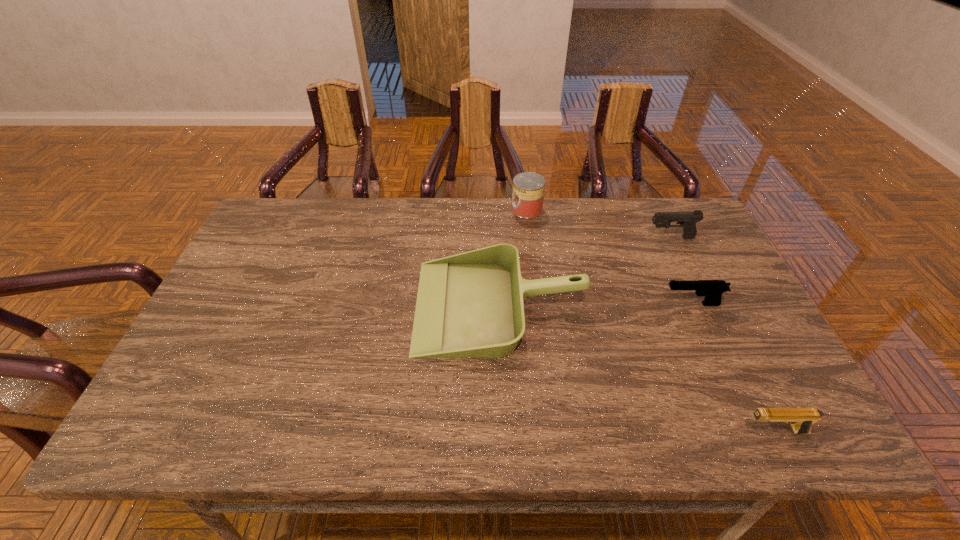
I want to click on free space between the nearest pistol and the second farthest pistol, so click(x=732, y=368).

Locate an element on the screen. The image size is (960, 540). vacant area that lies between the farthest object and the nearest object is located at coordinates pos(650,320).

Locate an element on the screen. The image size is (960, 540). vacant point located between the farthest object and the nearest object is located at coordinates (650, 320).

You are a GUI agent. You are given a task and a screenshot of the screen. Output one action in this format:
    pyautogui.click(x=<x>, y=<y>)
    Task: Click on the free point between the farthest pistol and the farthest object
    The width and height of the screenshot is (960, 540).
    Given the screenshot: What is the action you would take?
    pyautogui.click(x=599, y=224)

At what (x,y) coordinates should I click in order to perform the action: click on free space between the nearest object and the dustpan. Please return your answer as a coordinate pair (x, y). The image size is (960, 540). Looking at the image, I should click on (637, 369).

This screenshot has width=960, height=540. I want to click on free space between the farthest object and the second farthest pistol, so click(610, 256).

At what (x,y) coordinates should I click in order to perform the action: click on vacant space that is in between the can and the fourth nearest object. Please return your answer as a coordinate pair (x, y). This screenshot has height=540, width=960. Looking at the image, I should click on (599, 224).

The image size is (960, 540). I want to click on object that can be found as the third closest to the second farthest pistol, so click(801, 419).

Locate which object is the third closest to the dustpan. Please provide its 2D coordinates. Your answer should be formatted as a tuple, i.e. [(x, y)], where the tuple contains the x and y coordinates of a point satisfying the conditions above.

[(687, 220)]

The width and height of the screenshot is (960, 540). Find the location of `pistol that is the closest to the nearest pistol`. pistol that is the closest to the nearest pistol is located at coordinates (712, 289).